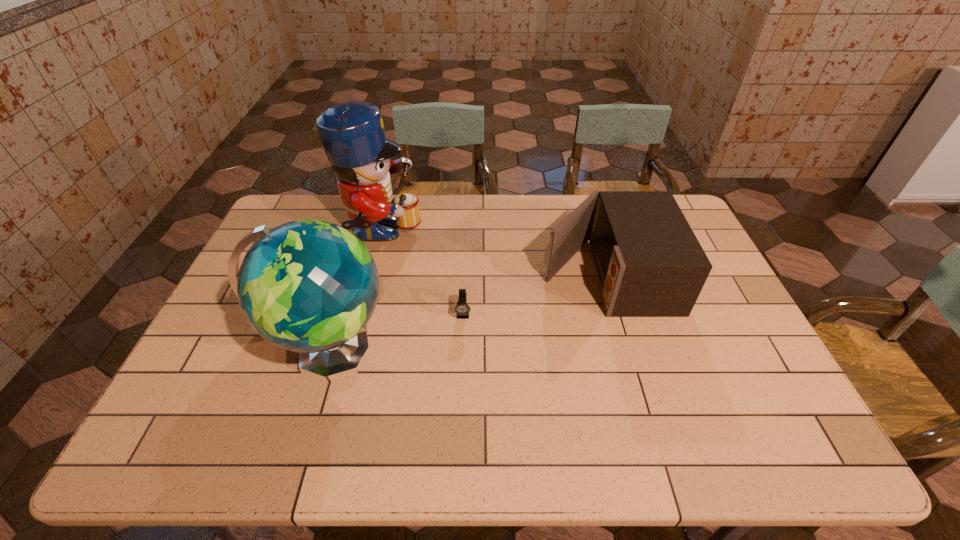
Locate an element on the screen. free space located 0.370m with the door open on the front of the third tallest object is located at coordinates (422, 275).

You are a GUI agent. You are given a task and a screenshot of the screen. Output one action in this format:
    pyautogui.click(x=<x>, y=<y>)
    Task: Click on the vacant area situated on the face of the shortest object
    
    Given the screenshot: What is the action you would take?
    pyautogui.click(x=462, y=362)

The image size is (960, 540). I want to click on object positioned at the far edge, so click(x=352, y=133).

Find the location of `object that is at the right edge`. object that is at the right edge is located at coordinates (650, 263).

This screenshot has width=960, height=540. In order to click on free location at the far edge of the desktop in this screenshot , I will do `click(329, 202)`.

Identify the location of vacant point at the near edge. (492, 451).

Locate an element on the screen. The image size is (960, 540). free space at the left edge of the desktop is located at coordinates (216, 328).

In the image, there is a desktop. Identify the location of free region at the right edge. (714, 345).

The width and height of the screenshot is (960, 540). I want to click on blank region between the shortest object and the microwave oven, so click(x=534, y=295).

Find the location of a particular element. The width and height of the screenshot is (960, 540). free space between the microwave oven and the third object from left to right is located at coordinates (534, 295).